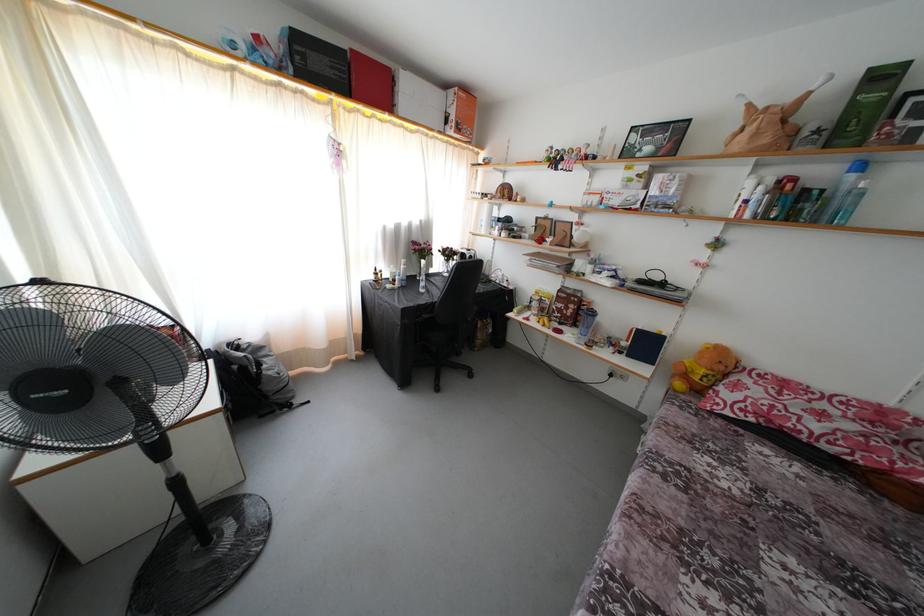
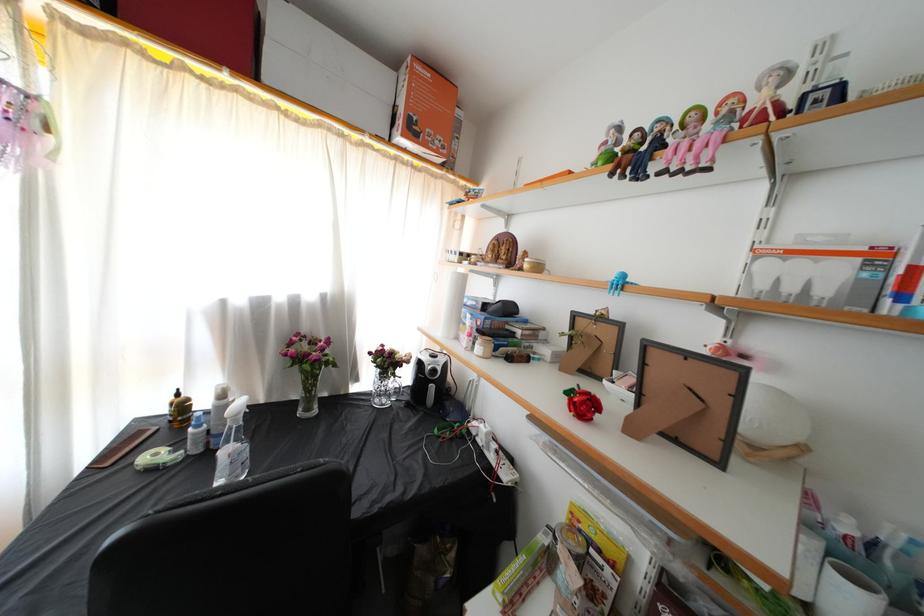
Question: I am providing you with two images of the same scene from different viewpoints. Please identify which objects are invisible in image2.

Choices:
 (A) small colorful doll
 (B) brown pump dispenser top
 (C) glass flower vase
 (D) none of these

Answer: (D)